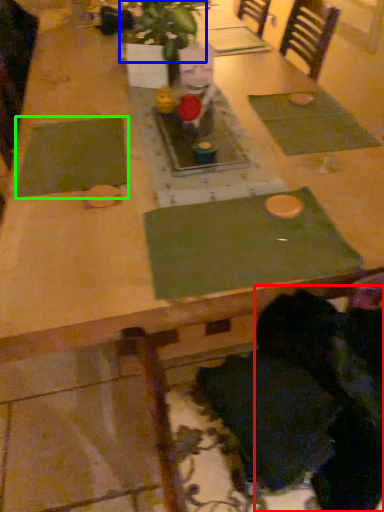
Question: Based on their relative distances, which object is farther from person (highlighted by a red box)? Choose from plant (highlighted by a blue box) and place mat (highlighted by a green box).

Choices:
 (A) plant
 (B) place mat

Answer: (A)